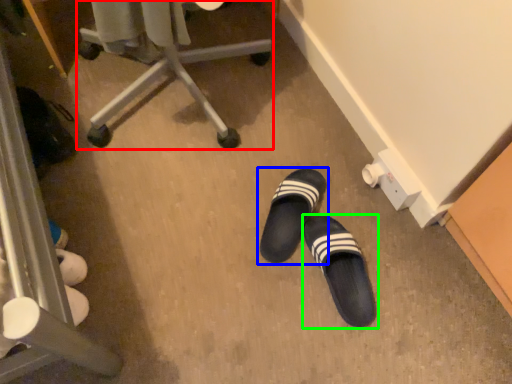
Question: Considering the real-world distances, which object is farthest from furniture (highlighted by a red box)? footwear (highlighted by a blue box) or footwear (highlighted by a green box)?

Choices:
 (A) footwear
 (B) footwear

Answer: (B)